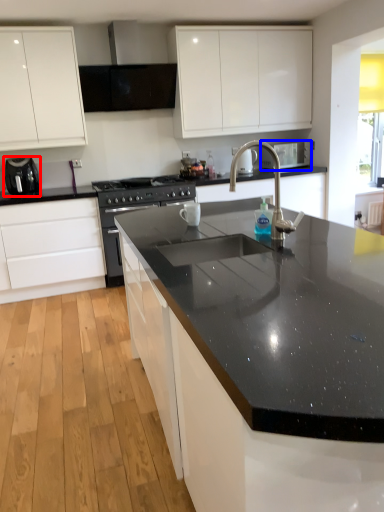
Question: Which point is closer to the camera, appliance (highlighted by a red box) or appliance (highlighted by a blue box)?

Choices:
 (A) appliance
 (B) appliance

Answer: (A)